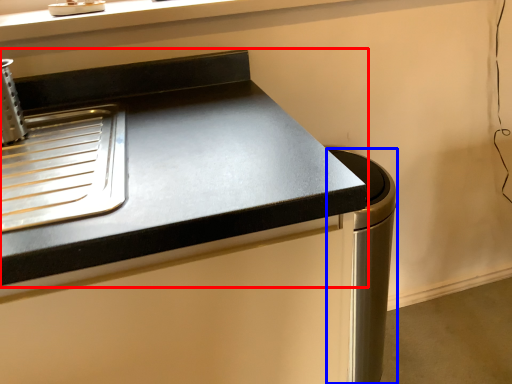
Question: Which of the following is the closest to the observer, countertop (highlighted by a red box) or appliance (highlighted by a blue box)?

Choices:
 (A) countertop
 (B) appliance

Answer: (A)